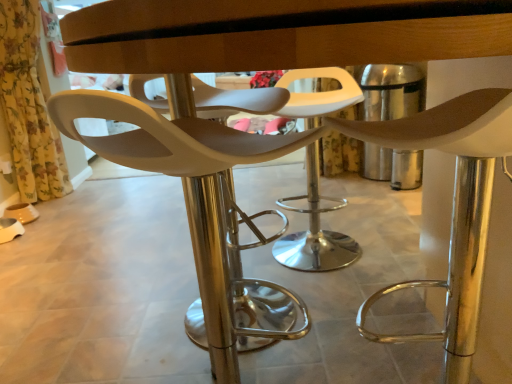
Question: Is yellow floral fabric at left at the left side of matte white chair at center, the second chair in the left-to-right sequence?

Choices:
 (A) yes
 (B) no

Answer: (A)

Question: Is yellow floral fabric at left shorter than matte white chair at center, the second chair in the left-to-right sequence?

Choices:
 (A) yes
 (B) no

Answer: (B)

Question: Considering the relative sizes of yellow floral fabric at left and matte white chair at center, marked as the first chair in a right-to-left arrangement, in the image provided, is yellow floral fabric at left bigger than matte white chair at center, marked as the first chair in a right-to-left arrangement,?

Choices:
 (A) no
 (B) yes

Answer: (B)

Question: Considering the relative sizes of yellow floral fabric at left and matte white chair at center, the second chair in the left-to-right sequence, in the image provided, is yellow floral fabric at left thinner than matte white chair at center, the second chair in the left-to-right sequence,?

Choices:
 (A) yes
 (B) no

Answer: (A)

Question: From a real-world perspective, does yellow floral fabric at left sit lower than matte white chair at center, the second chair in the left-to-right sequence?

Choices:
 (A) yes
 (B) no

Answer: (B)

Question: Looking at the image, does yellow floral fabric at left seem bigger or smaller compared to matte white chair at center, acting as the second chair starting from the right?

Choices:
 (A) small
 (B) big

Answer: (B)

Question: Considering their positions, is yellow floral fabric at left located in front of or behind matte white chair at center, acting as the second chair starting from the right?

Choices:
 (A) front
 (B) behind

Answer: (B)

Question: From a real-world perspective, is yellow floral fabric at left physically located above or below matte white chair at center, acting as the second chair starting from the right?

Choices:
 (A) above
 (B) below

Answer: (A)

Question: Based on their positions, is yellow floral fabric at left located to the left or right of matte white chair at center, acting as the second chair starting from the right?

Choices:
 (A) left
 (B) right

Answer: (A)

Question: Considering the positions of matte white chair at center, marked as the first chair in a right-to-left arrangement, and yellow floral fabric at left in the image, is matte white chair at center, marked as the first chair in a right-to-left arrangement, bigger or smaller than yellow floral fabric at left?

Choices:
 (A) small
 (B) big

Answer: (A)

Question: Choose the correct answer: Is matte white chair at center, marked as the first chair in a right-to-left arrangement, inside yellow floral fabric at left or outside it?

Choices:
 (A) outside
 (B) inside

Answer: (A)

Question: From a real-world perspective, is matte white chair at center, marked as the first chair in a right-to-left arrangement, positioned above or below yellow floral fabric at left?

Choices:
 (A) above
 (B) below

Answer: (B)

Question: Is point (458, 367) closer or farther from the camera than point (23, 21)?

Choices:
 (A) closer
 (B) farther

Answer: (A)

Question: Considering their positions, is matte white chair at center, acting as the second chair starting from the right, located in front of or behind yellow floral fabric at left?

Choices:
 (A) behind
 (B) front

Answer: (B)

Question: From a real-world perspective, is matte white chair at center, acting as the second chair starting from the right, physically located above or below yellow floral fabric at left?

Choices:
 (A) below
 (B) above

Answer: (A)